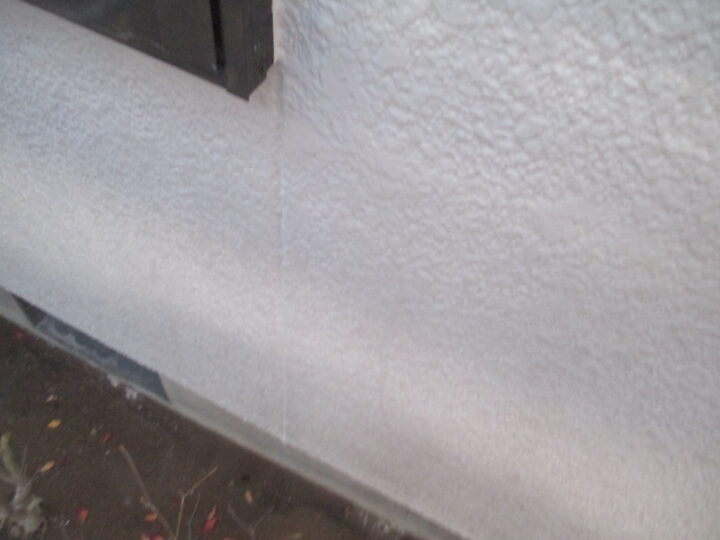
You are a GUI agent. You are given a task and a screenshot of the screen. Output one action in this format:
    pyautogui.click(x=<x>, y=<y>)
    Task: Click on the seam / crack in wall
    The width and height of the screenshot is (720, 540).
    Given the screenshot: What is the action you would take?
    pyautogui.click(x=282, y=264)